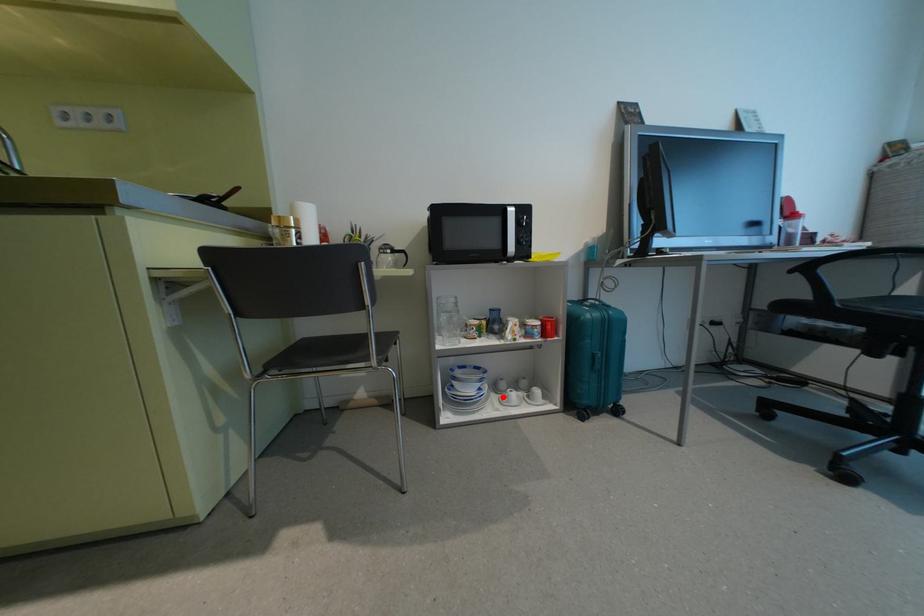
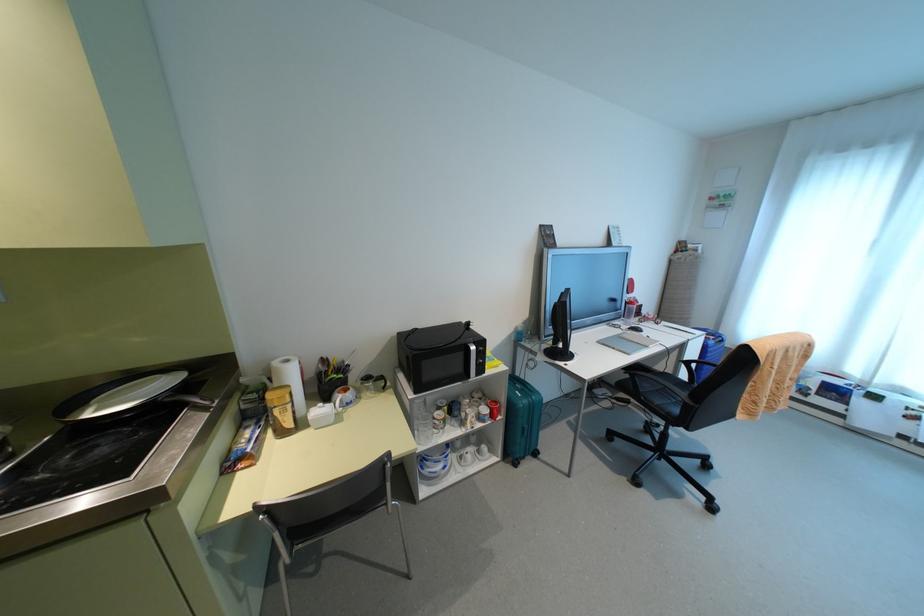
In the second image, find the point that corresponds to the highlighted location in the first image.

(459, 456)